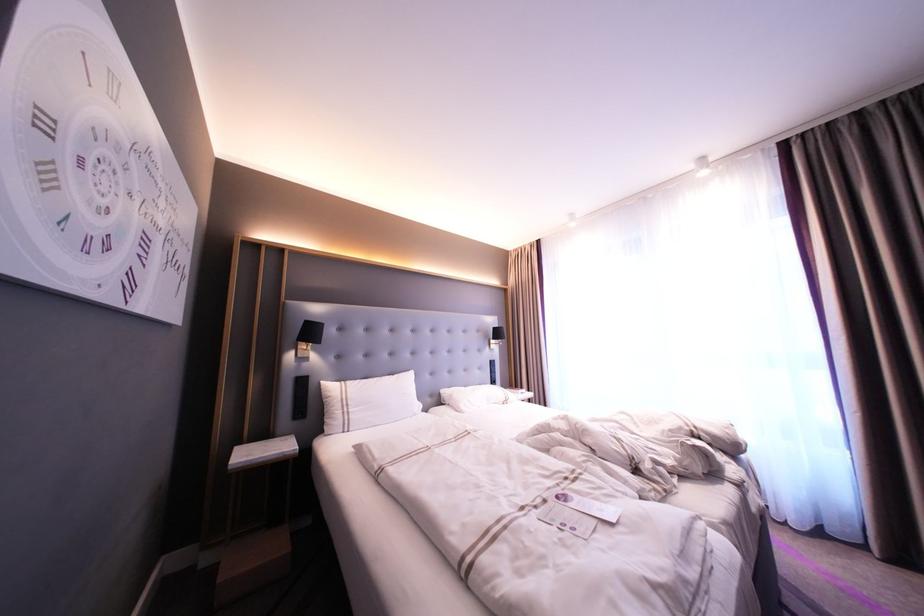
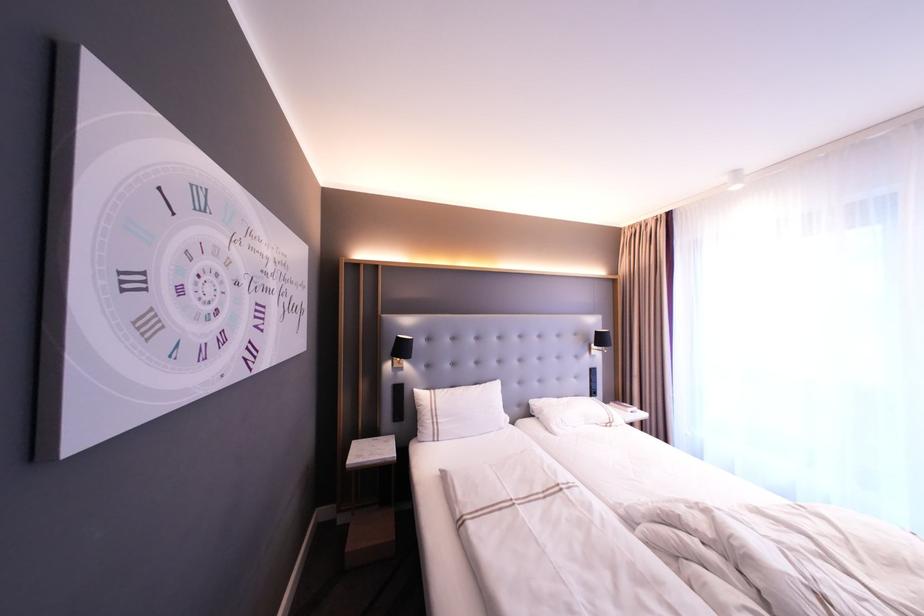
Find the pixel in the second image that matches (x=301, y=382) in the first image.

(397, 389)